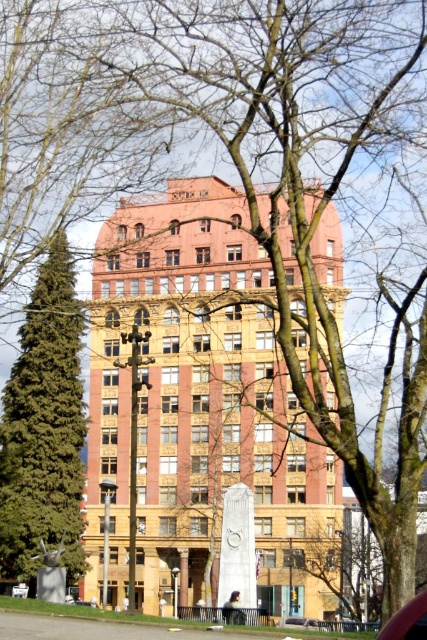
Question: Does green textured pine tree at left lie in front of metallic silver car at center?

Choices:
 (A) no
 (B) yes

Answer: (A)

Question: Can you confirm if green textured pine tree at left is positioned to the right of metallic silver car at center?

Choices:
 (A) no
 (B) yes

Answer: (A)

Question: Which point is closer to the camera taking this photo?

Choices:
 (A) (289, 618)
 (B) (403, 614)
 (C) (353, 532)

Answer: (B)

Question: Is green textured pine tree at left below metallic red car at lower right?

Choices:
 (A) no
 (B) yes

Answer: (A)

Question: Estimate the real-world distances between objects in this image. Which object is farther from the green textured pine tree at left?

Choices:
 (A) bare branches at center
 (B) metallic silver car at center
 (C) metallic red car at lower right

Answer: (C)

Question: Estimate the real-world distances between objects in this image. Which object is farther from the bare branches at center?

Choices:
 (A) green textured pine tree at left
 (B) metallic red car at lower right
 (C) metallic silver car at center

Answer: (B)